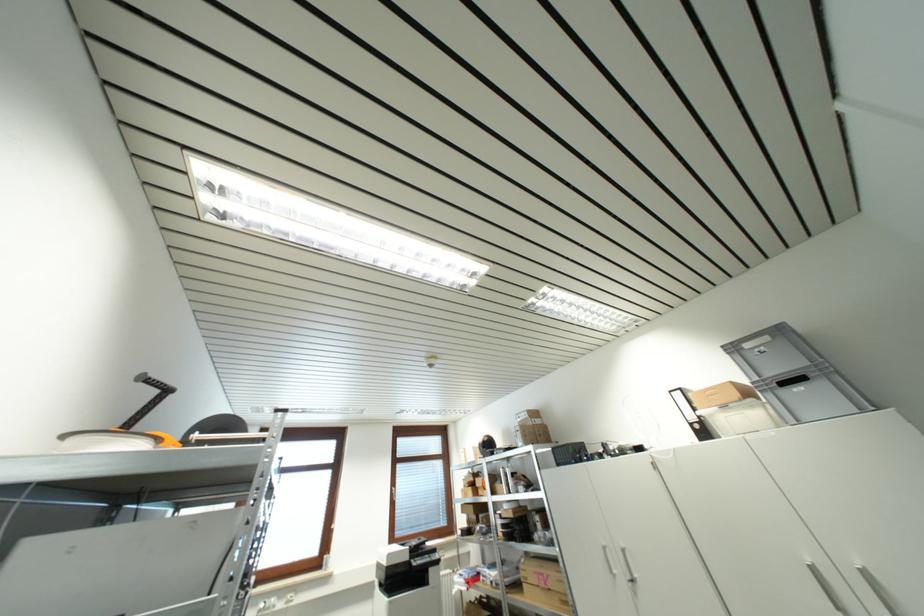
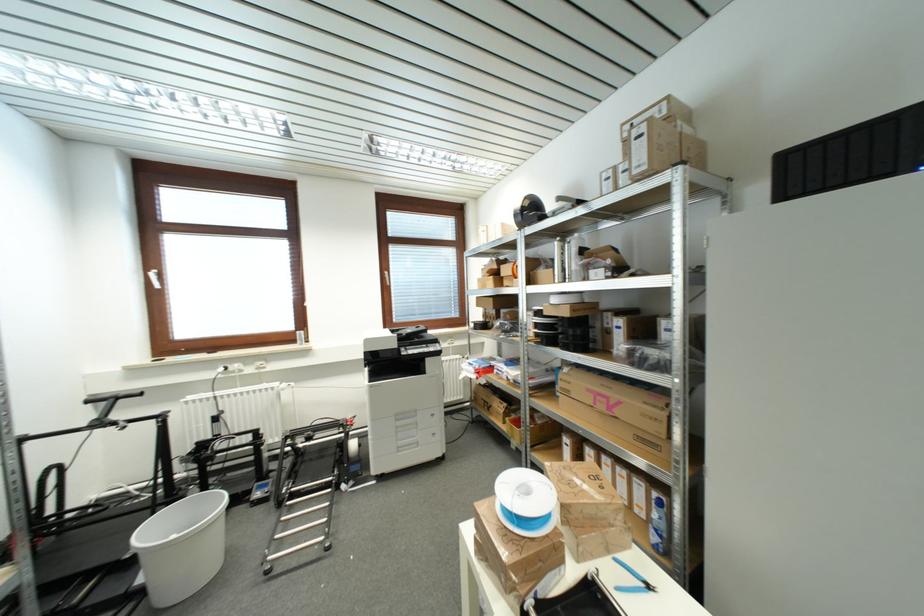
Locate, in the second image, the point that corresponds to the point at 484,442 in the first image.

(523, 207)